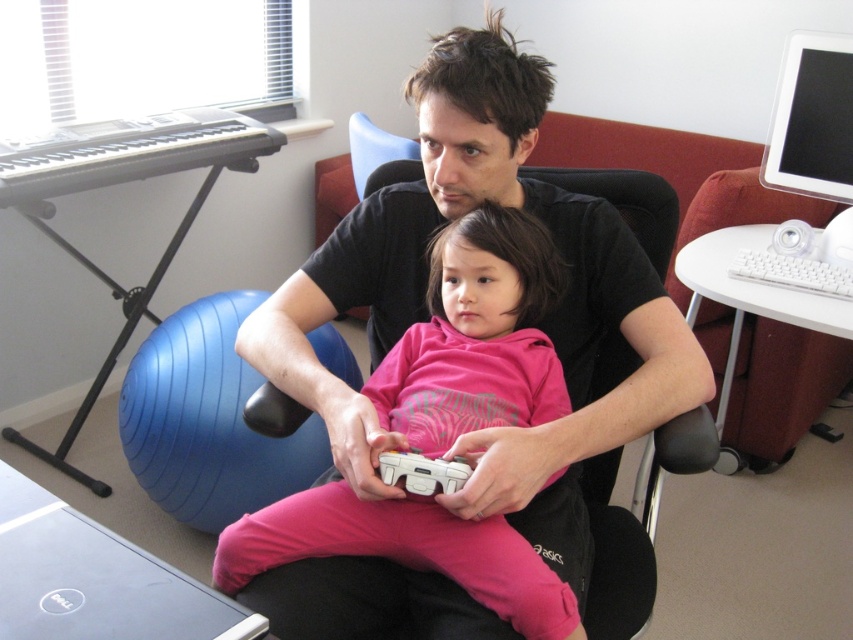
Question: Which point is farther to the camera?

Choices:
 (A) white matte game controller at center
 (B) pink matte/polyester shirt at center

Answer: (A)

Question: Is pink matte/polyester shirt at center behind white matte game controller at center?

Choices:
 (A) no
 (B) yes

Answer: (A)

Question: Is pink matte/polyester shirt at center further to camera compared to white matte game controller at center?

Choices:
 (A) no
 (B) yes

Answer: (A)

Question: Is pink matte/polyester shirt at center to the right of white matte game controller at center from the viewer's perspective?

Choices:
 (A) yes
 (B) no

Answer: (A)

Question: Which of the following is the farthest from the observer?

Choices:
 (A) (509, 352)
 (B) (410, 484)

Answer: (A)